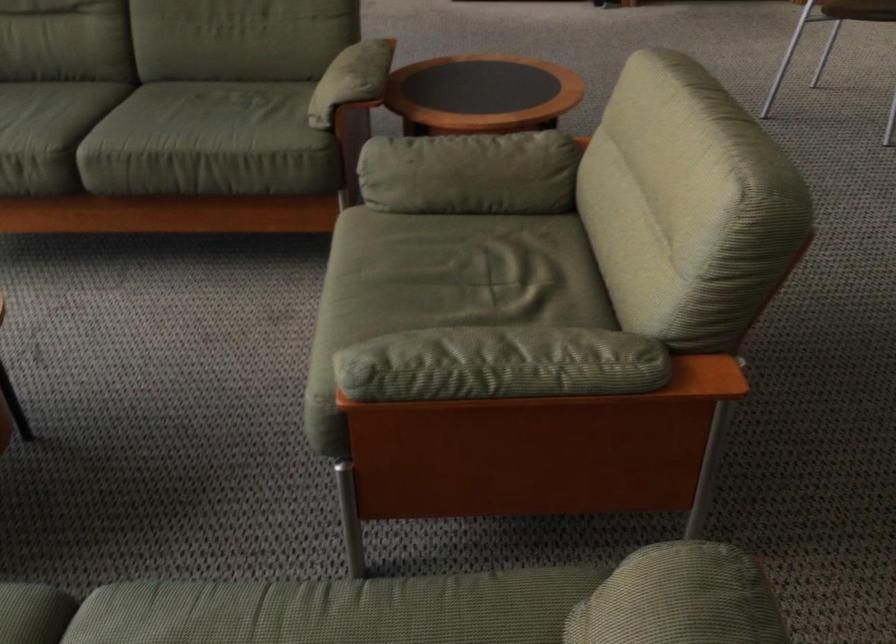
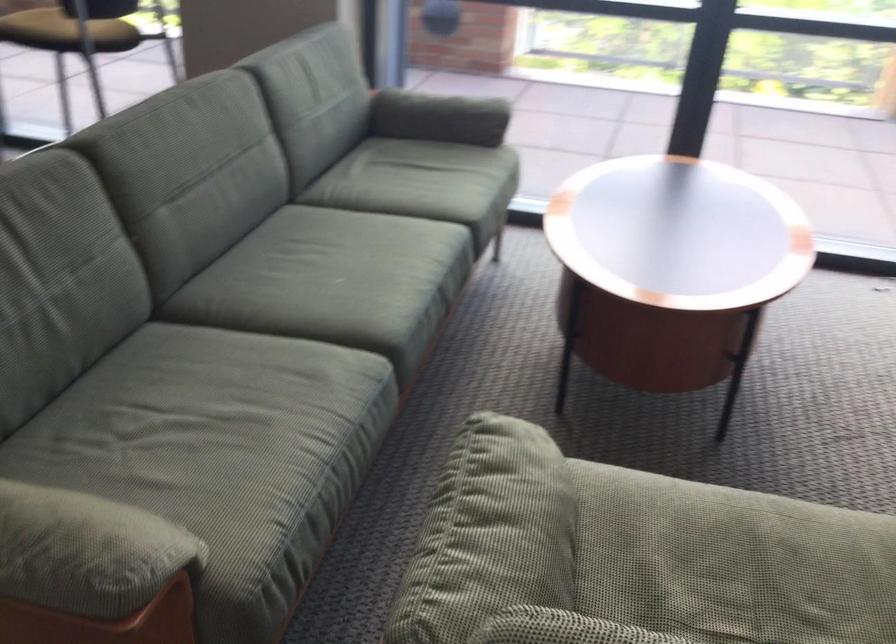
In the second image, find the point that corresponds to point 440,303 in the first image.

(702, 582)